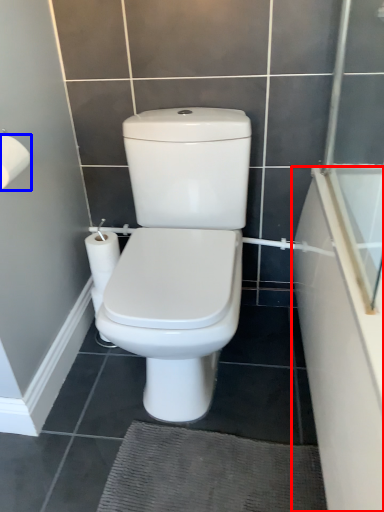
Question: Which object appears farthest to the camera in this image, bath (highlighted by a red box) or toilet paper (highlighted by a blue box)?

Choices:
 (A) bath
 (B) toilet paper

Answer: (B)